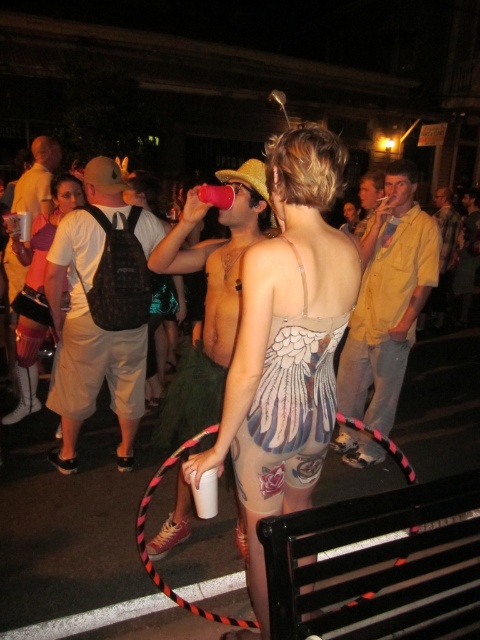
You are a photographer at the event and want to take a photo of the matte metallic dress at center. Where should you aim your camera to capture it?

The matte metallic dress at center is located at point 0.539 on the x axis and 0.598 on the y axis.